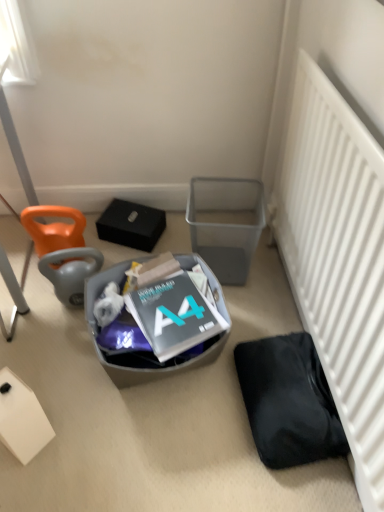
Question: Is white matte radiator at lower right inside white matte box at lower left?

Choices:
 (A) no
 (B) yes

Answer: (A)

Question: Is white matte box at lower left far from white matte radiator at lower right?

Choices:
 (A) no
 (B) yes

Answer: (A)

Question: From the image's perspective, is white matte box at lower left on top of white matte radiator at lower right?

Choices:
 (A) no
 (B) yes

Answer: (A)

Question: Can you confirm if white matte box at lower left is wider than white matte radiator at lower right?

Choices:
 (A) no
 (B) yes

Answer: (B)

Question: Considering the relative sizes of white matte box at lower left and white matte radiator at lower right in the image provided, is white matte box at lower left taller than white matte radiator at lower right?

Choices:
 (A) no
 (B) yes

Answer: (A)

Question: From the image's perspective, is translucent plastic trash bin at center, positioned as the second trash bin/can in right-to-left order, above or below black matte bag at lower right?

Choices:
 (A) below
 (B) above

Answer: (B)

Question: Looking at their shapes, would you say translucent plastic trash bin at center, which is the first trash bin/can from left to right, is wider or thinner than black matte bag at lower right?

Choices:
 (A) thin
 (B) wide

Answer: (B)

Question: In the image, is translucent plastic trash bin at center, positioned as the second trash bin/can in right-to-left order, positioned in front of or behind black matte bag at lower right?

Choices:
 (A) behind
 (B) front

Answer: (B)

Question: Choose the correct answer: Is translucent plastic trash bin at center, positioned as the second trash bin/can in right-to-left order, inside black matte bag at lower right or outside it?

Choices:
 (A) outside
 (B) inside

Answer: (A)

Question: Is point (66, 259) closer or farther from the camera than point (39, 204)?

Choices:
 (A) farther
 (B) closer

Answer: (B)

Question: From the image's perspective, relative to orange fabric bean bag chair at left, which ranks as the second bean bag chair in bottom-to-top order, is orange fabric bean bag chair at left, which ranks as the second bean bag chair in top-to-bottom order, above or below?

Choices:
 (A) below
 (B) above

Answer: (A)

Question: In terms of width, does orange fabric bean bag chair at left, which ranks as the second bean bag chair in top-to-bottom order, look wider or thinner when compared to orange fabric bean bag chair at left, which ranks as the second bean bag chair in bottom-to-top order?

Choices:
 (A) thin
 (B) wide

Answer: (A)

Question: In the image, is orange fabric bean bag chair at left, which ranks as the second bean bag chair in top-to-bottom order, positioned in front of or behind orange fabric bean bag chair at left, which ranks as the second bean bag chair in bottom-to-top order?

Choices:
 (A) behind
 (B) front

Answer: (B)

Question: In terms of size, does orange fabric bean bag chair at left, which ranks as the second bean bag chair in top-to-bottom order, appear bigger or smaller than metallic gray trash bin at center right, the 2th trash bin/can in the left-to-right sequence?

Choices:
 (A) small
 (B) big

Answer: (A)

Question: Based on their positions, is orange fabric bean bag chair at left, positioned as the first bean bag chair in bottom-to-top order, located to the left or right of metallic gray trash bin at center right, the 2th trash bin/can in the left-to-right sequence?

Choices:
 (A) right
 (B) left

Answer: (B)